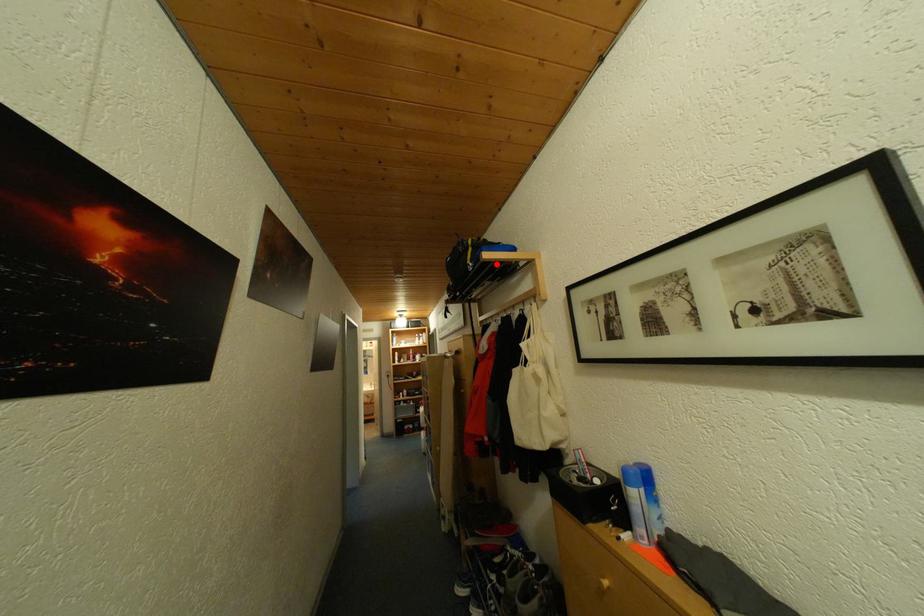
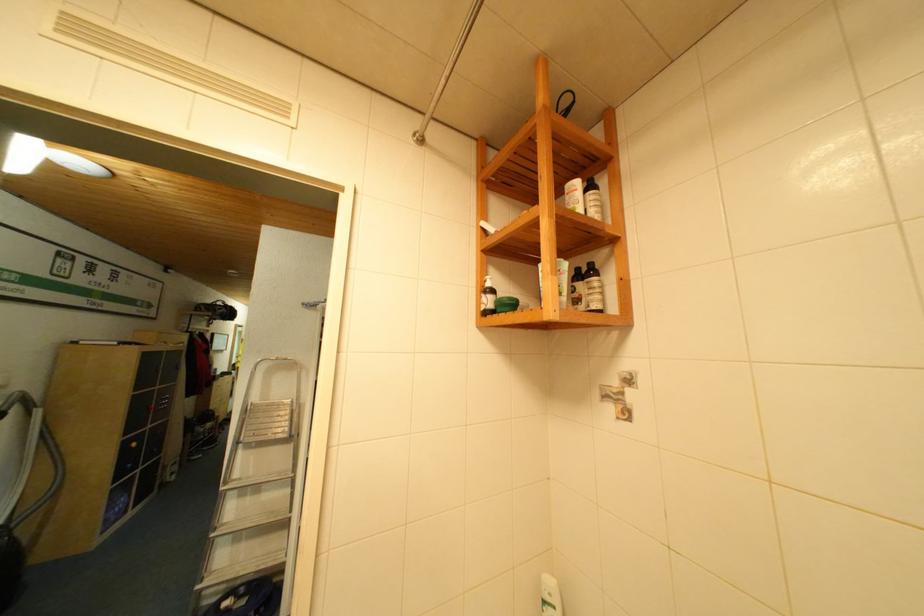
Question: I am providing you with two images of the same scene from different viewpoints. A red point is marked on the first image. Is the red point's position out of view in image 2?

Choices:
 (A) Yes
 (B) No

Answer: (A)